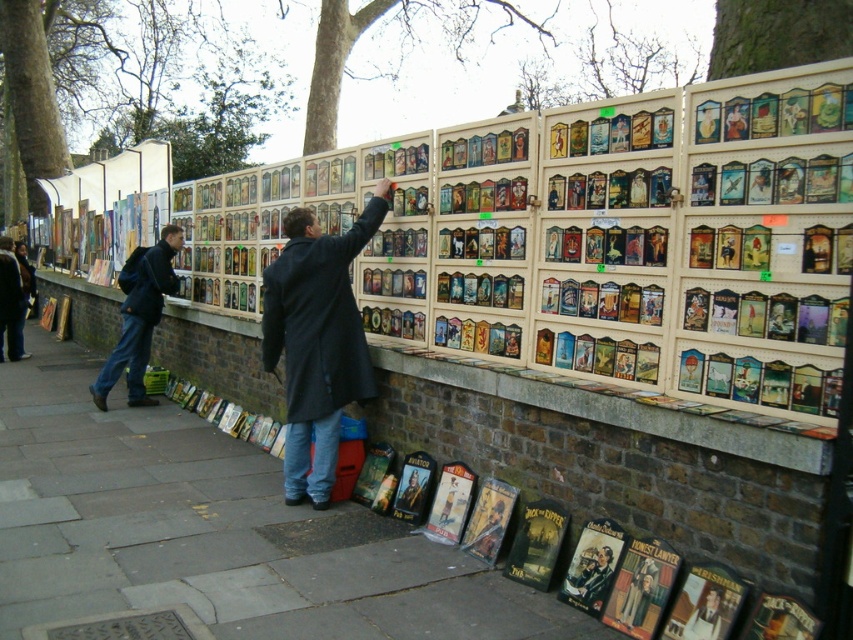
Question: Can you confirm if matte black book at lower center is positioned below dark blue jeans at lower left?

Choices:
 (A) yes
 (B) no

Answer: (A)

Question: Which object is closer to the camera taking this photo?

Choices:
 (A) dark blue coat at center
 (B) matte black poster at center
 (C) matte black poster at lower center

Answer: (B)

Question: Estimate the real-world distances between objects in this image. Which object is closer to the matte black book at lower center?

Choices:
 (A) dark blue jeans at left
 (B) matte black poster at center

Answer: (B)

Question: From the image, what is the correct spatial relationship of dark blue coat at center in relation to matte black poster at center?

Choices:
 (A) above
 (B) below

Answer: (A)

Question: Which point appears closest to the camera in this image?

Choices:
 (A) (711, 616)
 (B) (144, 392)
 (C) (7, 284)
 (D) (672, 493)

Answer: (A)

Question: Does dark blue coat at center have a smaller size compared to matte black book at lower center?

Choices:
 (A) no
 (B) yes

Answer: (A)